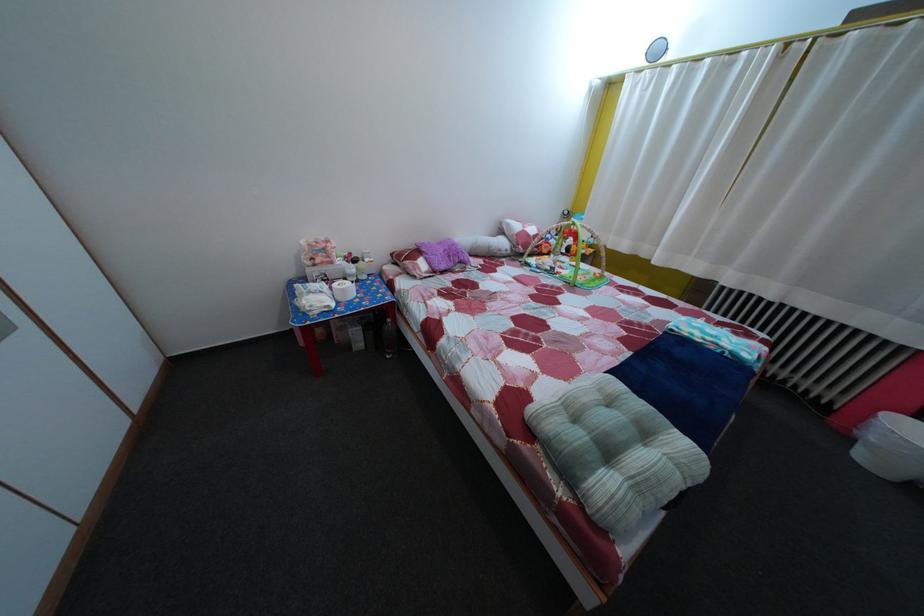
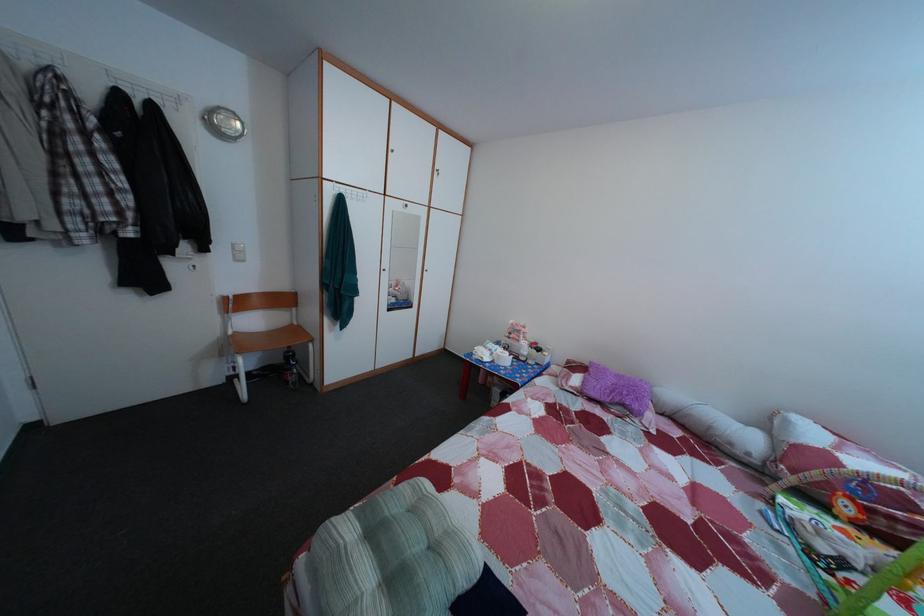
In the second image, find the point that corresponds to [594,408] in the first image.

(440, 521)